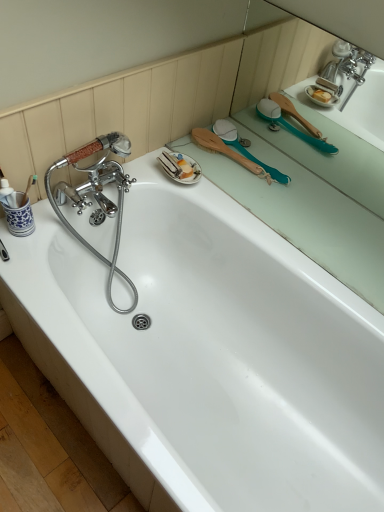
Where is `vacant area that is situated to the right of wooden-brushed teal brush at upper right`? The height and width of the screenshot is (512, 384). vacant area that is situated to the right of wooden-brushed teal brush at upper right is located at coordinates (316, 189).